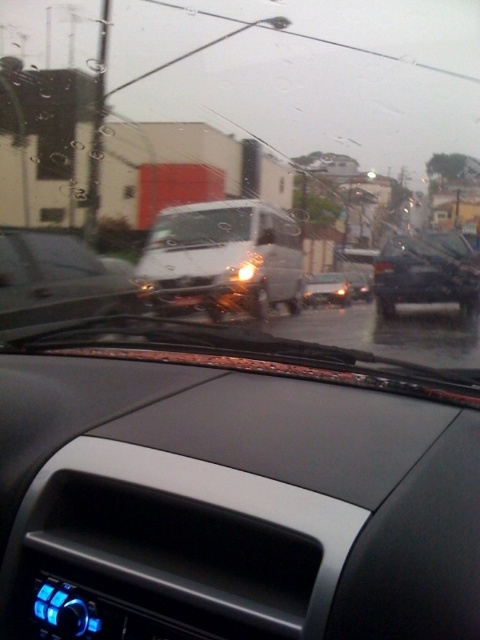
Question: Which object appears farthest from the camera in this image?

Choices:
 (A) glossy white van at center
 (B) transparent glass windshield at center
 (C) black matte car at right

Answer: (A)

Question: Does black matte car at right appear under glossy white van at center?

Choices:
 (A) yes
 (B) no

Answer: (B)

Question: Among these points, which one is nearest to the camera?

Choices:
 (A) (223, 58)
 (B) (235, 234)
 (C) (330, 289)
 (D) (478, 260)

Answer: (B)

Question: Can you confirm if transparent glass windshield at center is thinner than satin white van at center?

Choices:
 (A) no
 (B) yes

Answer: (A)

Question: Is transparent glass windshield at center positioned at the back of satin white van at center?

Choices:
 (A) no
 (B) yes

Answer: (A)

Question: Which point is closer to the camera?

Choices:
 (A) black matte car at right
 (B) satin white van at center

Answer: (A)